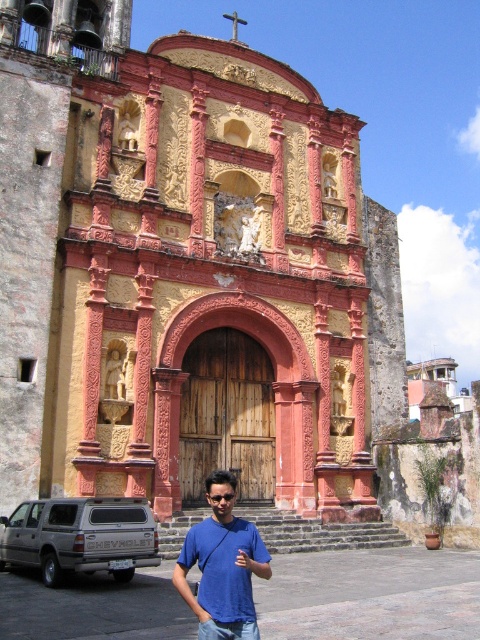
You are standing at the point marked as point (95, 282) and want to take a photo of the church facade. Considering the distance between you and the church, will you be able to capture the entire facade in one shot without moving closer?

The distance between you and the church is 139.08 feet. Since this distance is quite far, it is likely that you can capture the entire facade in one shot without needing to move closer, as the church would appear smaller in the frame from that distance.